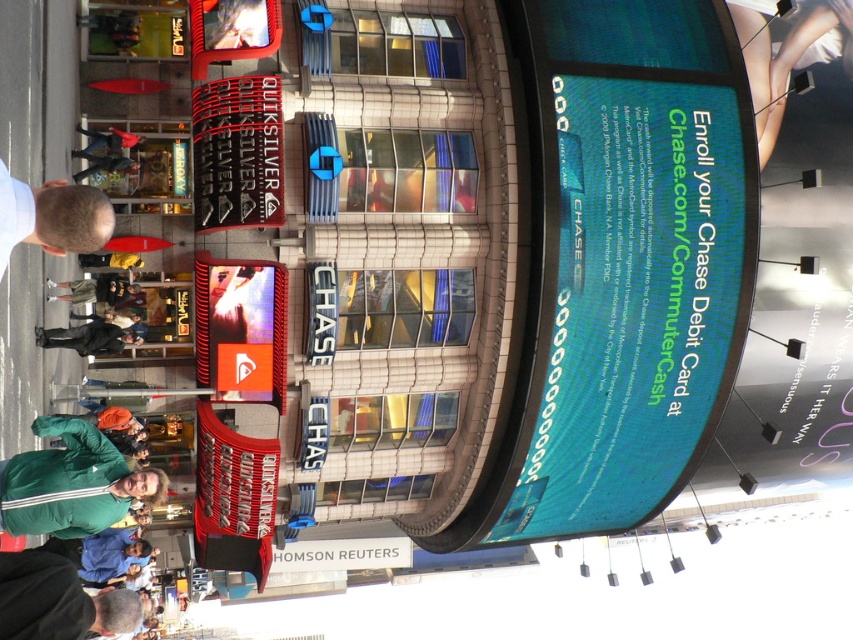
Question: Which of the following is the closest to the observer?

Choices:
 (A) (27, 212)
 (B) (311, 282)
 (C) (252, 84)

Answer: (A)

Question: Does smooth skin at upper right lie in front of blue metallic sign at center?

Choices:
 (A) no
 (B) yes

Answer: (A)

Question: Which of these objects is positioned closest to the green track jacket at lower left?

Choices:
 (A) dark gray jacket at lower left
 (B) green jacket at lower left
 (C) blonde hair at left
 (D) red fabric cap at upper left

Answer: (C)

Question: From the image, what is the correct spatial relationship of black matte sign at upper left in relation to green track jacket at lower left?

Choices:
 (A) right
 (B) left

Answer: (A)

Question: Estimate the real-world distances between objects in this image. Which object is closer to the dark gray jacket at lower left?

Choices:
 (A) red fabric cap at upper left
 (B) smooth skin at upper right
 (C) green jacket at lower left
 (D) blonde hair at left

Answer: (C)

Question: Does black matte sign at upper left have a lesser width compared to red fabric cap at upper left?

Choices:
 (A) yes
 (B) no

Answer: (B)